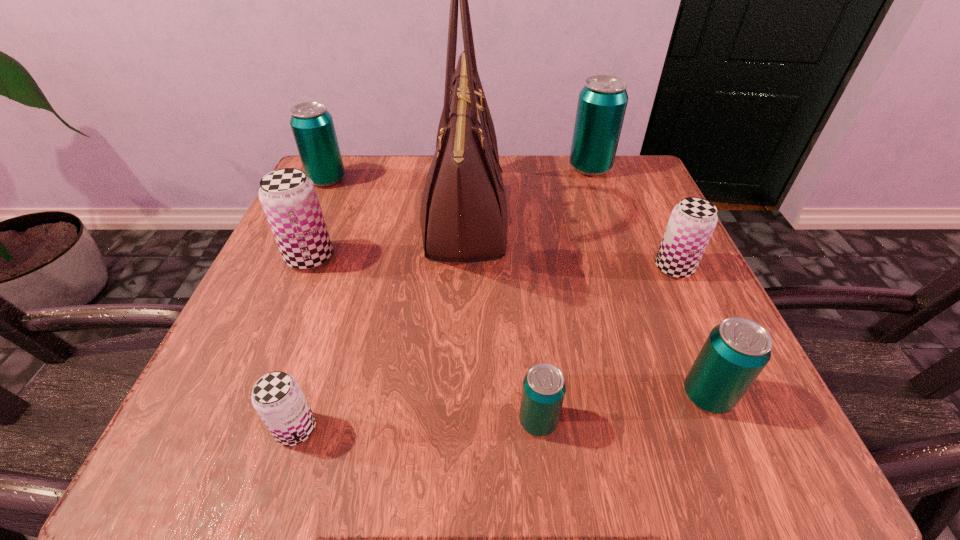
The height and width of the screenshot is (540, 960). I want to click on object that is at the far left corner, so click(x=312, y=125).

What are the coordinates of `object situated at the near left corner` in the screenshot? It's located at [277, 397].

Find the location of a particular element. object that is at the far right corner is located at coordinates (602, 102).

At what (x,y) coordinates should I click in order to perform the action: click on object that is at the near right corner. Please return your answer as a coordinate pair (x, y). This screenshot has height=540, width=960. Looking at the image, I should click on (736, 351).

In the image, there is a desktop. What are the coordinates of `vacant space at the far edge` in the screenshot? It's located at (524, 183).

What are the coordinates of `vacant area at the near edge of the desktop` in the screenshot? It's located at (609, 405).

In order to click on vacant space at the right edge of the desktop in this screenshot , I will do `click(620, 277)`.

This screenshot has height=540, width=960. I want to click on vacant space at the far right corner of the desktop, so click(x=638, y=163).

Locate an element on the screen. This screenshot has width=960, height=540. vacant space in between the third beer can from left to right and the third biggest teal beer can is located at coordinates (502, 413).

Where is `free space that is in between the second biggest teal beer can and the tallest object`? Image resolution: width=960 pixels, height=540 pixels. free space that is in between the second biggest teal beer can and the tallest object is located at coordinates (396, 200).